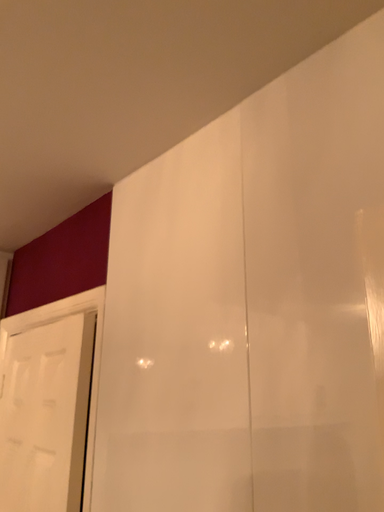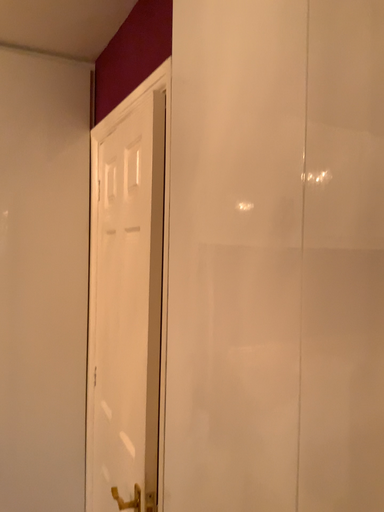
Question: How did the camera likely rotate when shooting the video?

Choices:
 (A) rotated downward
 (B) rotated upward

Answer: (A)